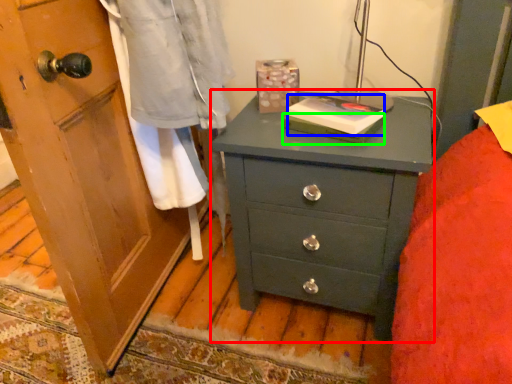
Question: Estimate the real-world distances between objects in this image. Which object is closer to chest of drawers (highlighted by a red box), book (highlighted by a blue box) or book (highlighted by a green box)?

Choices:
 (A) book
 (B) book

Answer: (A)